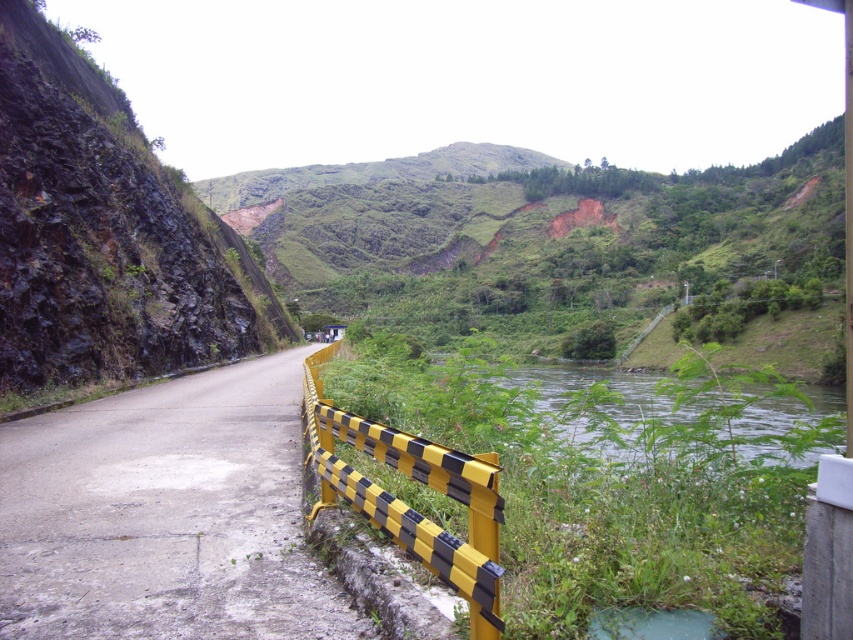
You are standing at point (100,536) and want to walk to point (432,552). Given the scene described, which direction should you face to move towards your destination?

Since point (100,536) is behind point (432,552), you should face forward to move towards your destination.